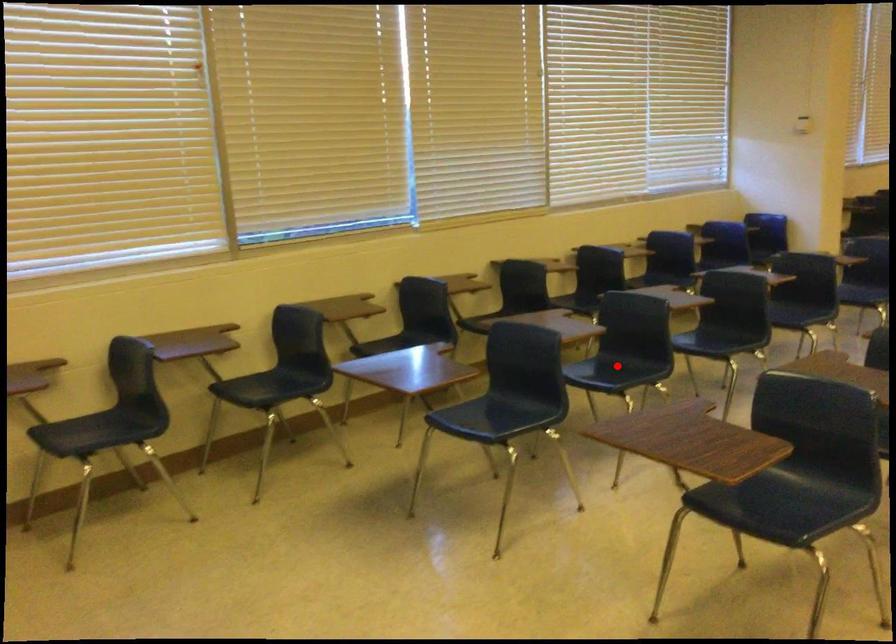
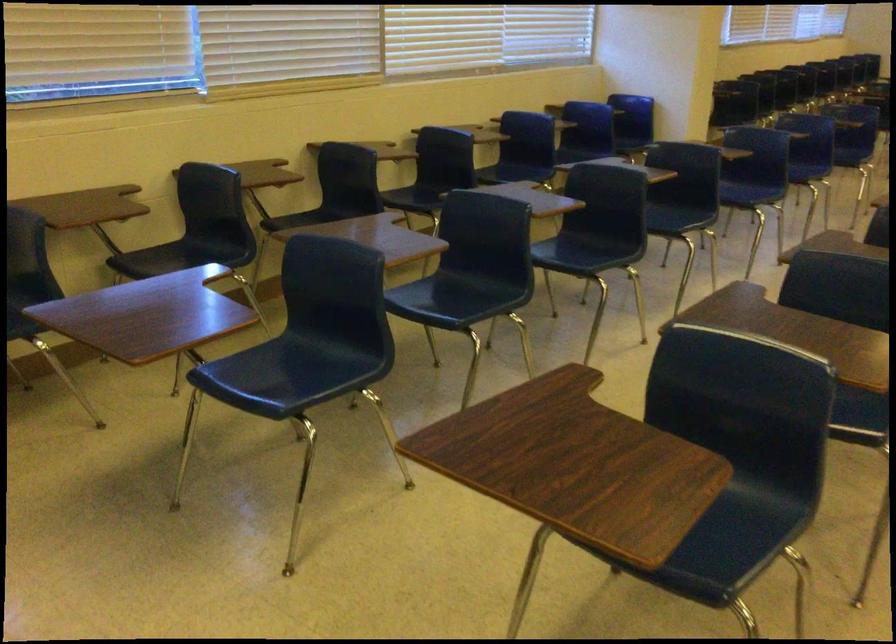
Find the pixel in the second image that matches the highlighted location in the first image.

(462, 292)